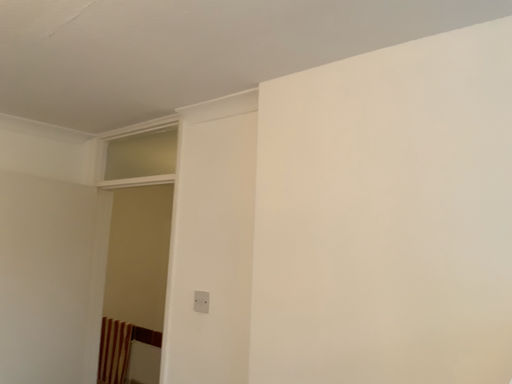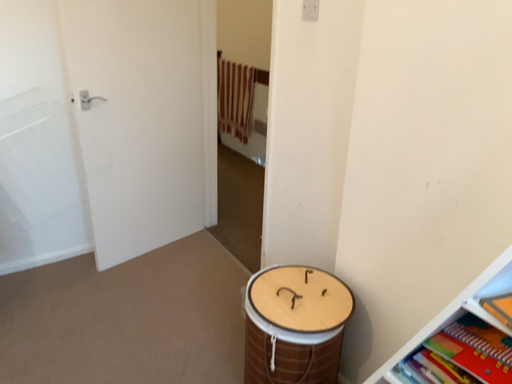
Question: How did the camera likely rotate when shooting the video?

Choices:
 (A) rotated upward
 (B) rotated downward

Answer: (B)